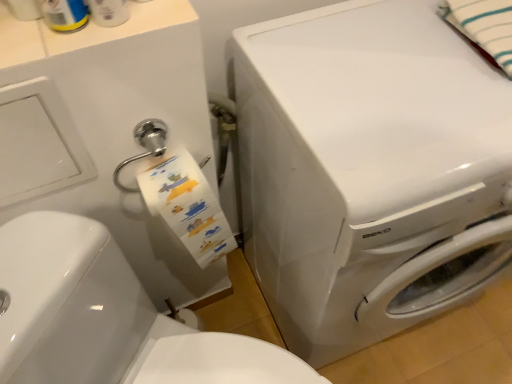
Question: Is white striped fabric at upper right oriented away from white glossy washing machine at center?

Choices:
 (A) yes
 (B) no

Answer: (B)

Question: Does white striped fabric at upper right have a smaller size compared to white glossy washing machine at center?

Choices:
 (A) no
 (B) yes

Answer: (B)

Question: Does white striped fabric at upper right have a greater height compared to white glossy washing machine at center?

Choices:
 (A) no
 (B) yes

Answer: (A)

Question: Is white striped fabric at upper right completely or partially outside of white glossy washing machine at center?

Choices:
 (A) yes
 (B) no

Answer: (A)

Question: From a real-world perspective, does white striped fabric at upper right stand above white glossy washing machine at center?

Choices:
 (A) no
 (B) yes

Answer: (B)

Question: In the image, is white glossy washer at center positioned in front of or behind white glossy washing machine at center?

Choices:
 (A) front
 (B) behind

Answer: (A)

Question: In the image, is white glossy washer at center on the left side or the right side of white glossy washing machine at center?

Choices:
 (A) left
 (B) right

Answer: (A)

Question: Considering the positions of white glossy washer at center and white glossy washing machine at center in the image, is white glossy washer at center bigger or smaller than white glossy washing machine at center?

Choices:
 (A) small
 (B) big

Answer: (A)

Question: Considering the positions of white glossy washer at center and white glossy washing machine at center in the image, is white glossy washer at center wider or thinner than white glossy washing machine at center?

Choices:
 (A) wide
 (B) thin

Answer: (A)

Question: Is point (501, 18) positioned closer to the camera than point (256, 198)?

Choices:
 (A) closer
 (B) farther

Answer: (A)

Question: From the image's perspective, is white striped fabric at upper right positioned above or below white glossy washing machine at center?

Choices:
 (A) above
 (B) below

Answer: (A)

Question: Considering the positions of white striped fabric at upper right and white glossy washing machine at center in the image, is white striped fabric at upper right bigger or smaller than white glossy washing machine at center?

Choices:
 (A) small
 (B) big

Answer: (A)

Question: From a real-world perspective, is white striped fabric at upper right positioned above or below white glossy washing machine at center?

Choices:
 (A) above
 (B) below

Answer: (A)

Question: Relative to white glossy washer at center, is white striped fabric at upper right in front or behind?

Choices:
 (A) behind
 (B) front

Answer: (A)

Question: Visually, is white striped fabric at upper right positioned to the left or to the right of white glossy washer at center?

Choices:
 (A) left
 (B) right

Answer: (B)